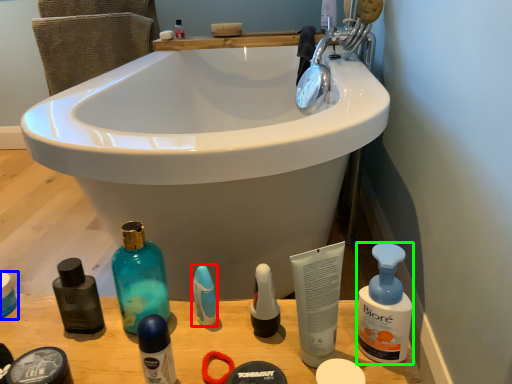
Question: Which object is positioned farthest from toiletry (highlighted by a red box)? Select from personal care (highlighted by a blue box) and cleaning product (highlighted by a green box).

Choices:
 (A) personal care
 (B) cleaning product

Answer: (A)